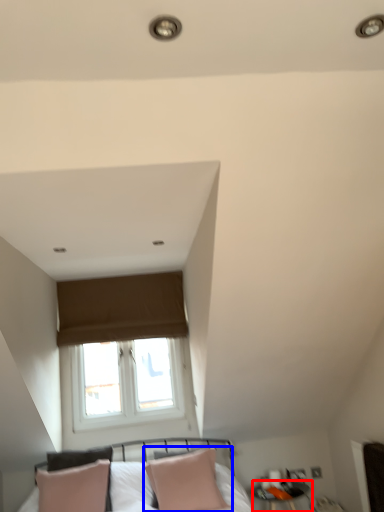
Question: Which object is further to the camera taking this photo, side table (highlighted by a red box) or pillow (highlighted by a blue box)?

Choices:
 (A) side table
 (B) pillow

Answer: (A)